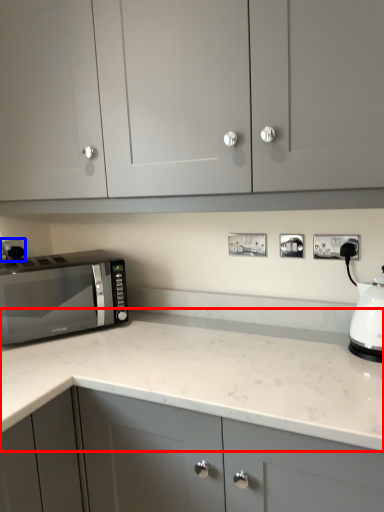
Question: Which object is closer to the camera taking this photo, countertop (highlighted by a red box) or electric outlet (highlighted by a blue box)?

Choices:
 (A) countertop
 (B) electric outlet

Answer: (A)